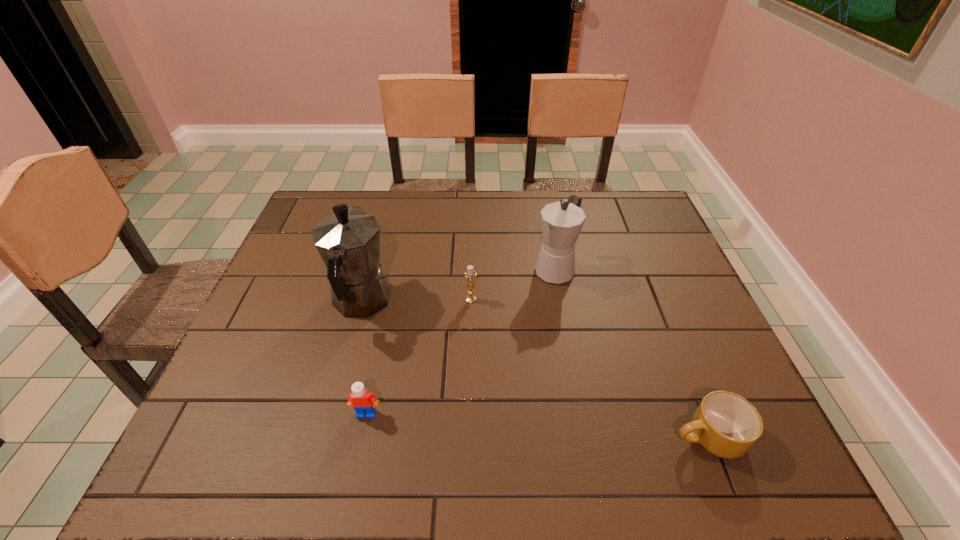
Find the location of a particular element. the taller coffeepot is located at coordinates (348, 241).

Where is `the left coffeepot`? the left coffeepot is located at coordinates (348, 241).

The height and width of the screenshot is (540, 960). I want to click on the right coffeepot, so tap(562, 221).

You are a GUI agent. You are given a task and a screenshot of the screen. Output one action in this format:
    pyautogui.click(x=<x>, y=<y>)
    Task: Click on the second object from right to left
    Image resolution: width=960 pixels, height=540 pixels.
    Given the screenshot: What is the action you would take?
    pyautogui.click(x=562, y=221)

Locate an element on the screen. This screenshot has width=960, height=540. the third object from right to left is located at coordinates (470, 274).

You are a GUI agent. You are given a task and a screenshot of the screen. Output one action in this format:
    pyautogui.click(x=<x>, y=<y>)
    Task: Click on the Lego
    The width and height of the screenshot is (960, 540).
    Given the screenshot: What is the action you would take?
    pyautogui.click(x=363, y=401)

The width and height of the screenshot is (960, 540). I want to click on mug, so click(725, 424).

Identify the location of the shortest object. (725, 424).

The height and width of the screenshot is (540, 960). Find the location of `free point located on the pouring side of the taller coffeepot`. free point located on the pouring side of the taller coffeepot is located at coordinates (x=383, y=222).

At what (x,y) coordinates should I click in order to perform the action: click on free region located on the pouring side of the taller coffeepot. Please return your answer as a coordinate pair (x, y). The image size is (960, 540). Looking at the image, I should click on pyautogui.click(x=389, y=201).